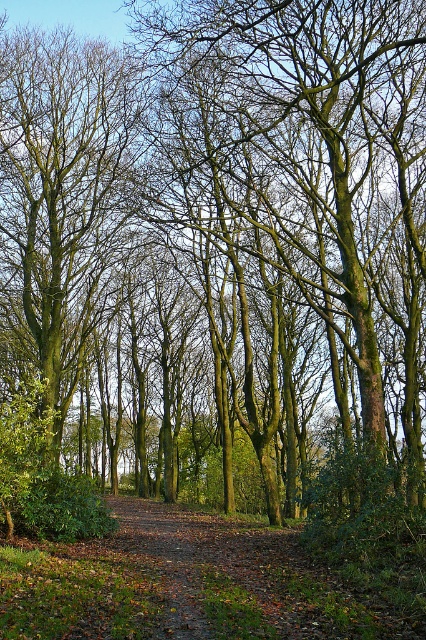
Question: Which of the following is the farthest from the observer?

Choices:
 (A) green mossy tree at center
 (B) brown leafy path at center

Answer: (A)

Question: Is green mossy tree at center bigger than brown leafy path at center?

Choices:
 (A) yes
 (B) no

Answer: (A)

Question: From the image, what is the correct spatial relationship of green mossy tree at center in relation to brown leafy path at center?

Choices:
 (A) left
 (B) right

Answer: (A)

Question: Does green mossy tree at center appear under brown leafy path at center?

Choices:
 (A) no
 (B) yes

Answer: (A)